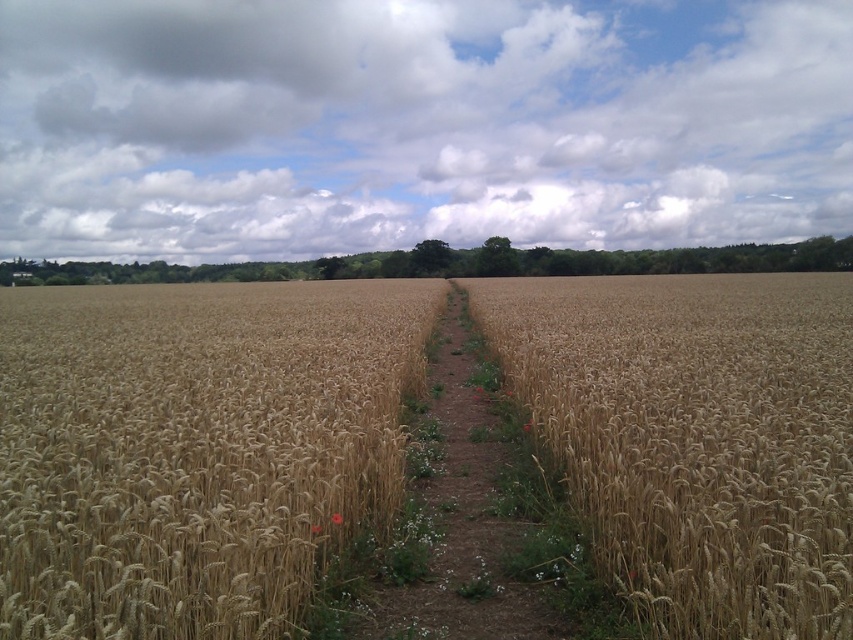
In the scene shown: Is golden wheat at center smaller than golden matte wheat at center?

Actually, golden wheat at center might be larger than golden matte wheat at center.

Is golden wheat at center above golden matte wheat at center?

No.

Describe the element at coordinates (194, 449) in the screenshot. The image size is (853, 640). I see `golden wheat at center` at that location.

Image resolution: width=853 pixels, height=640 pixels. Identify the location of golden wheat at center. (194, 449).

Who is positioned more to the right, golden wheat at center or brown dirt path at center?

Positioned to the right is brown dirt path at center.

Which is below, golden wheat at center or brown dirt path at center?

brown dirt path at center is lower down.

Does point (64, 596) come farther from viewer compared to point (483, 348)?

No, it is in front of (483, 348).

Find the location of a particular element. golden wheat at center is located at coordinates (194, 449).

What do you see at coordinates (695, 438) in the screenshot? I see `golden matte wheat at center` at bounding box center [695, 438].

Between golden matte wheat at center and brown dirt path at center, which one is positioned higher?

golden matte wheat at center is above.

Is point (743, 616) positioned behind point (457, 513)?

That is False.

This screenshot has height=640, width=853. What are the coordinates of `golden matte wheat at center` in the screenshot? It's located at (695, 438).